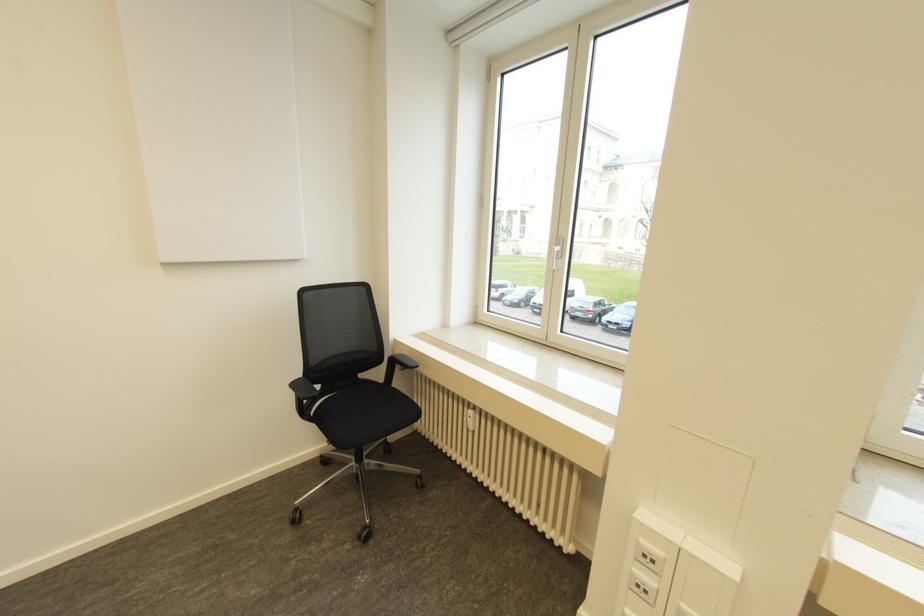
Describe the element at coordinates (642, 586) in the screenshot. I see `the white light switch` at that location.